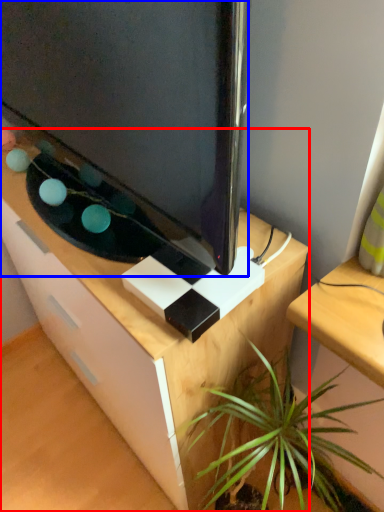
Question: Which point is closer to the camera, desk (highlighted by a red box) or television (highlighted by a blue box)?

Choices:
 (A) desk
 (B) television

Answer: (B)